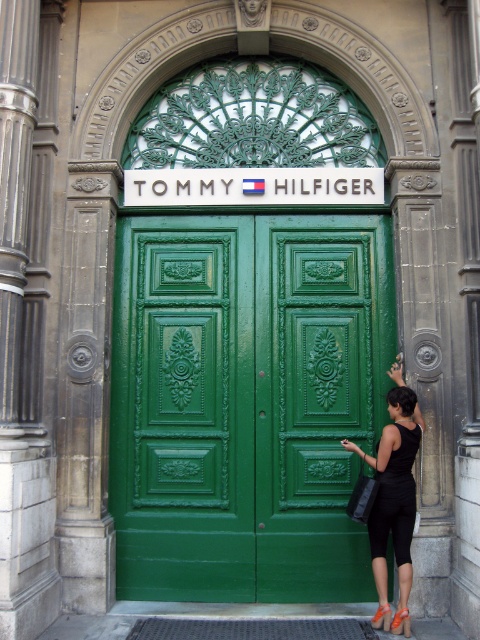
Question: Is the position of green polished wood door at center more distant than that of black fabric dress at lower right?

Choices:
 (A) no
 (B) yes

Answer: (B)

Question: Which object appears closest to the camera in this image?

Choices:
 (A) dark gray stone column at center
 (B) green polished wood door at center

Answer: (A)

Question: Which is farther from the dark gray stone column at center?

Choices:
 (A) black fabric dress at lower right
 (B) green polished wood door at center

Answer: (A)

Question: Is green polished wood door at center wider than dark gray stone column at center?

Choices:
 (A) yes
 (B) no

Answer: (A)

Question: Which point is farther to the camera?

Choices:
 (A) (16, 456)
 (B) (132, 264)
 (C) (408, 476)

Answer: (B)

Question: Is green polished wood door at center wider than black fabric dress at lower right?

Choices:
 (A) yes
 (B) no

Answer: (A)